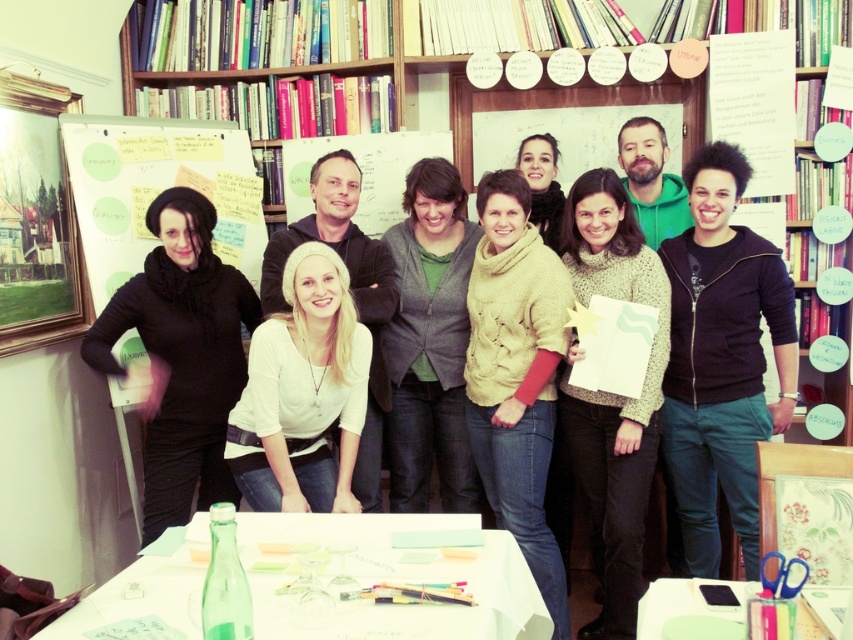
You are organizing a meeting in this room and need to place a new item on the table. You have a knitted sweater at center and a white paper table at center. Where should you place the item to ensure it is visible to everyone around the table?

Place the item on the white paper table at center, which is to the left of the knitted sweater at center, ensuring it is centrally located for visibility.

Please describe the position of the wooden bookcase at upper center in the image using coordinates.

The wooden bookcase at upper center is located at coordinates 0.052 in the x axis and 0.267 in the y axis.

You are a person who needs to place a 12 inch long book on the table. You see the white paper table at center and the knitted sweater at center. Can you fit the book between them?

The white paper table at center and the knitted sweater at center are 38.78 inches apart from each other. Since the book is only 12 inches long, there is enough space between them to fit the book.